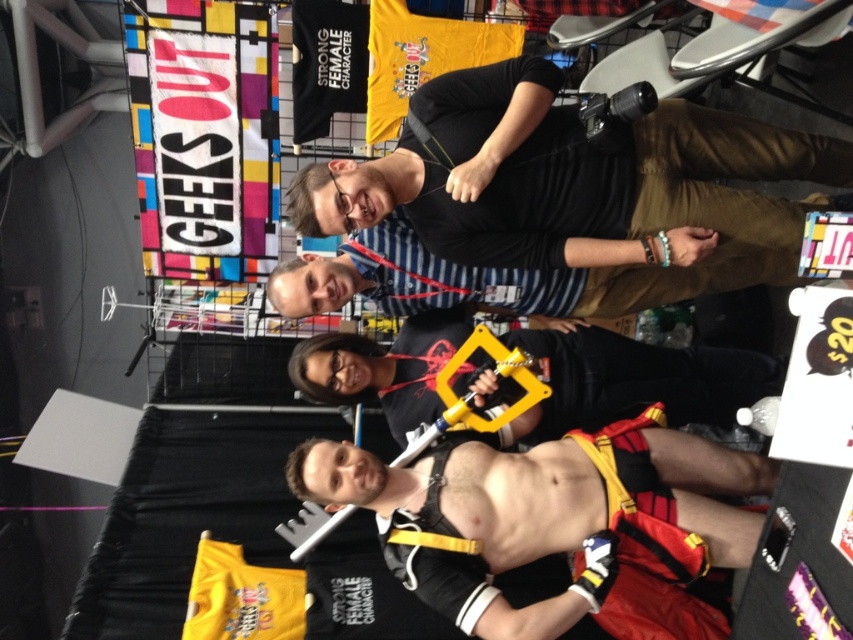
Is black leather harness at center positioned before yellow plastic handcuffs at center?

That is True.

Is point (463, 577) in front of point (700, 358)?

Yes.

You are a GUI agent. You are given a task and a screenshot of the screen. Output one action in this format:
    pyautogui.click(x=<x>, y=<y>)
    Task: Click on the black leather harness at center
    Image resolution: width=853 pixels, height=640 pixels.
    Given the screenshot: What is the action you would take?
    pyautogui.click(x=543, y=515)